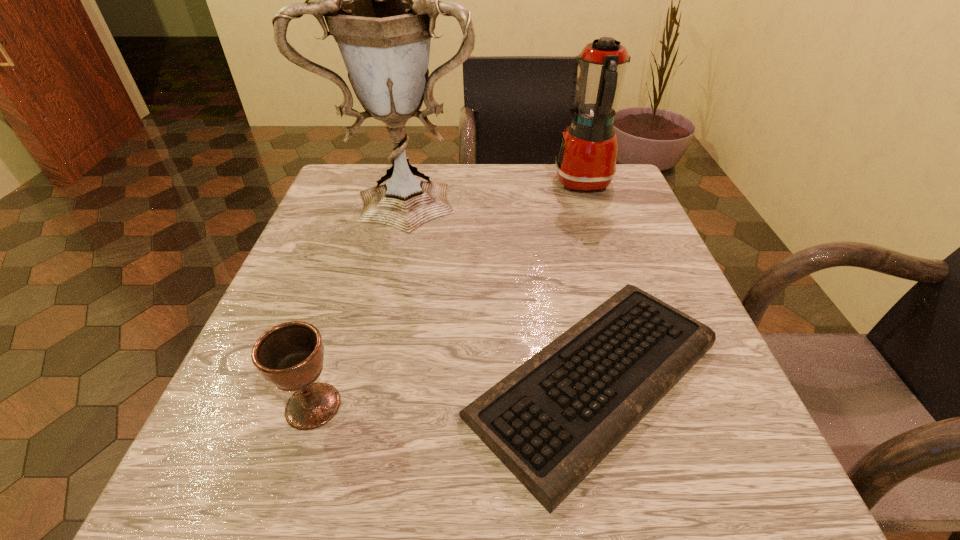
Locate an element on the screen. Image resolution: width=960 pixels, height=540 pixels. vacant space that's between the third shortest object and the shortest object is located at coordinates (588, 281).

I want to click on free point between the trophy cup and the computer keyboard, so [502, 287].

Identify the location of free space between the second shortest object and the shortest object. (454, 393).

Where is `free space between the tallest object and the chalice`? The image size is (960, 540). free space between the tallest object and the chalice is located at coordinates (361, 301).

You are a GUI agent. You are given a task and a screenshot of the screen. Output one action in this format:
    pyautogui.click(x=<x>, y=<y>)
    Task: Click on the empty space that is in between the tallest object and the shortest object
    This screenshot has width=960, height=540.
    Given the screenshot: What is the action you would take?
    pyautogui.click(x=502, y=287)

Locate an element on the screen. This screenshot has height=540, width=960. free spot between the trophy cup and the shortest object is located at coordinates (502, 287).

The width and height of the screenshot is (960, 540). Identify the location of object that is the second closest one to the computer keyboard. (380, 0).

Find the location of a particular element. This screenshot has height=540, width=960. object that is the closest to the chalice is located at coordinates (551, 421).

Where is `free point that satisfies the following two spatial constraints: 1. on the controls of the second tallest object; 2. on the front side of the shortest object`? The width and height of the screenshot is (960, 540). free point that satisfies the following two spatial constraints: 1. on the controls of the second tallest object; 2. on the front side of the shortest object is located at coordinates (650, 380).

I want to click on vacant point that satisfies the following two spatial constraints: 1. on the front side of the trophy cup; 2. on the left side of the shortest object, so click(x=368, y=380).